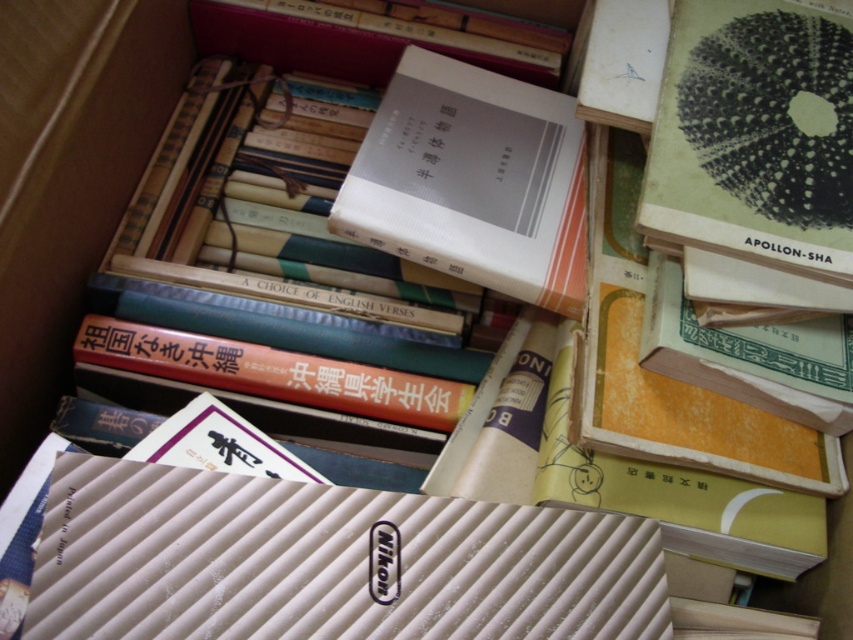
Please describe the position of the white textured filter at lower left in terms of coordinates within the image. The image has a coordinate system where the bottom left corner is the origin point. The coordinates are given as a pair of numbers between 0 and 1, representing the horizontal and vertical positions respectively. The horizontal axis goes from 0 on the left to 1 on the right, and the vertical axis goes from 0 at the bottom to 1 at the top. Based on this coordinate system, what are the coordinates

The white textured filter at lower left is located at coordinates point (x=326, y=563).

You are organizing a box of books and notice the green matte book at upper right and the white matte book at center. Which book is closer to you when looking into the box?

The green matte book at upper right is closer to you because it is in front of the white matte book at center.